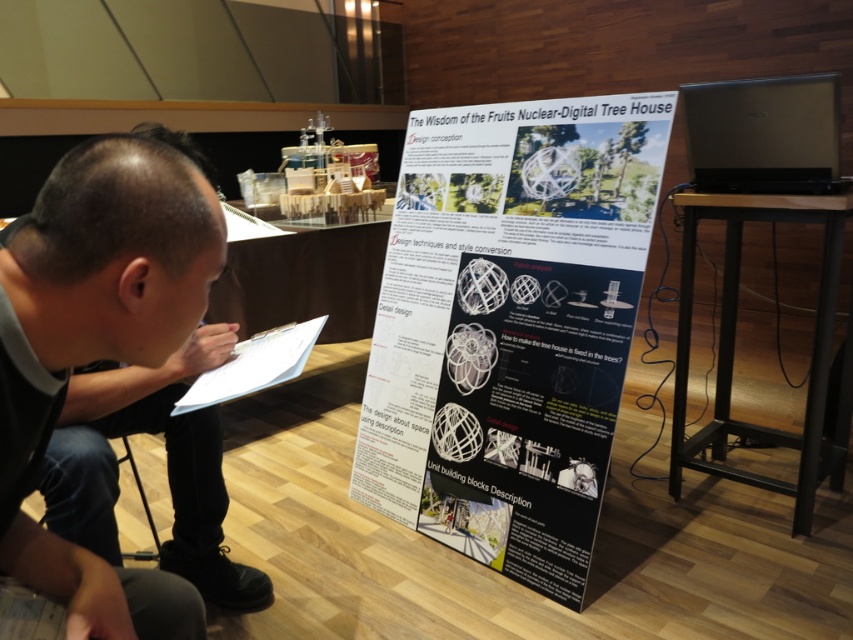
Question: Does white paperboard poster at center have a lesser width compared to black plastic stool at lower left?

Choices:
 (A) yes
 (B) no

Answer: (B)

Question: Which of the following is the closest to the observer?

Choices:
 (A) (125, 449)
 (B) (756, 184)
 (C) (218, 465)
 (D) (201, 403)

Answer: (D)

Question: Can you confirm if white paper at center is positioned above black plastic stool at lower left?

Choices:
 (A) no
 (B) yes

Answer: (B)

Question: Is the position of black fabric pants at lower left more distant than that of black plastic stool at lower left?

Choices:
 (A) yes
 (B) no

Answer: (B)

Question: Which of the following is the closest to the observer?

Choices:
 (A) (279, 360)
 (B) (402, 218)

Answer: (A)

Question: Which of the following is the farthest from the observer?

Choices:
 (A) white paper at center
 (B) white paperboard poster at center
 (C) black fabric pants at lower left
 (D) silver metallic laptop at upper right

Answer: (D)